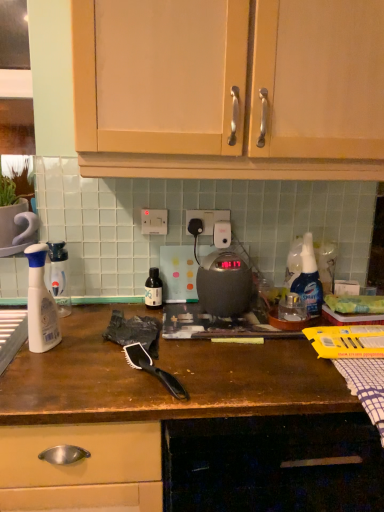
Locate an element on the screen. This screenshot has height=512, width=384. free space between white plastic spray bottle at left, marked as the first bottle in a left-to-right arrangement, and matte black bottle at center, which is counted as the 2th bottle, starting from the left is located at coordinates (105, 312).